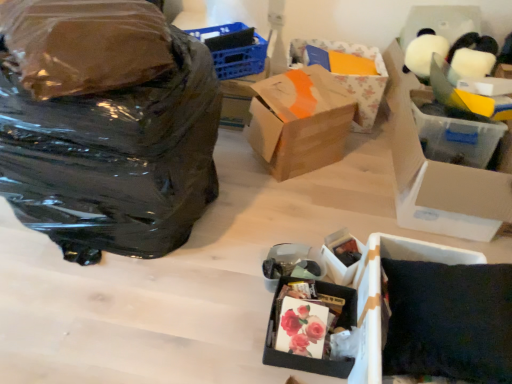
The width and height of the screenshot is (512, 384). I want to click on free point behind matte black box at lower center, the 4th box in the top-to-bottom sequence, so click(x=334, y=227).